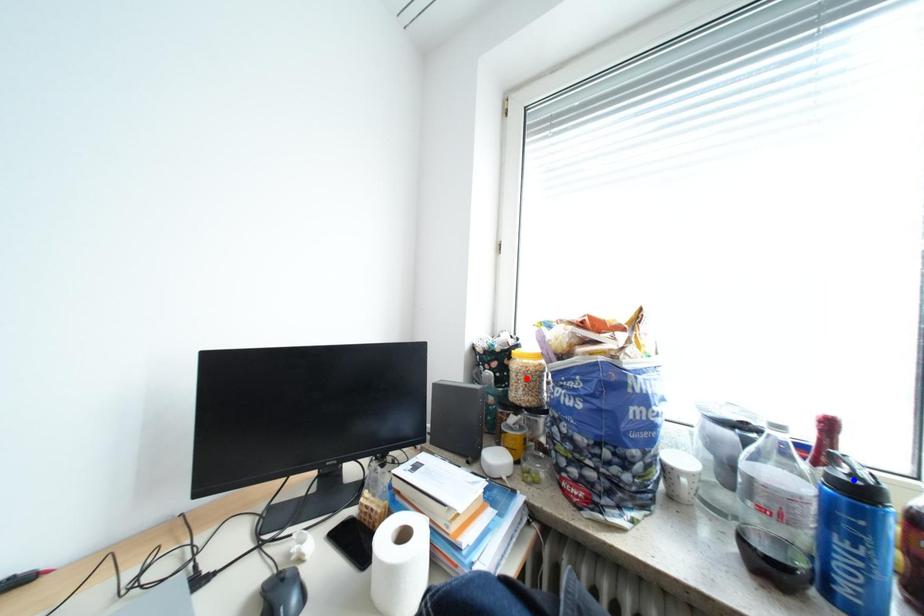
Question: In the image, two points are highlighted. Which point is nearer to the camera? Reply with the corresponding letter.

Choices:
 (A) blue point
 (B) red point

Answer: (A)